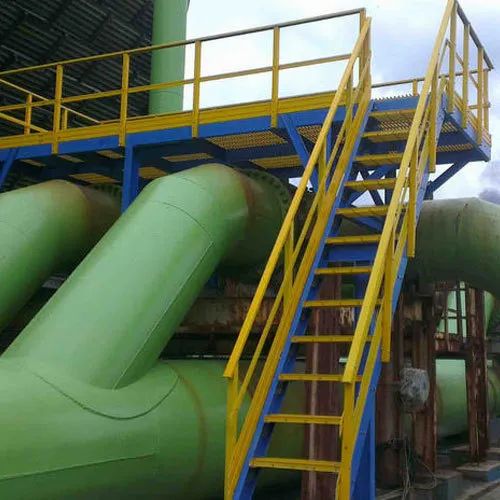
The width and height of the screenshot is (500, 500). Find the location of `5th stair`. 5th stair is located at coordinates (350, 300).